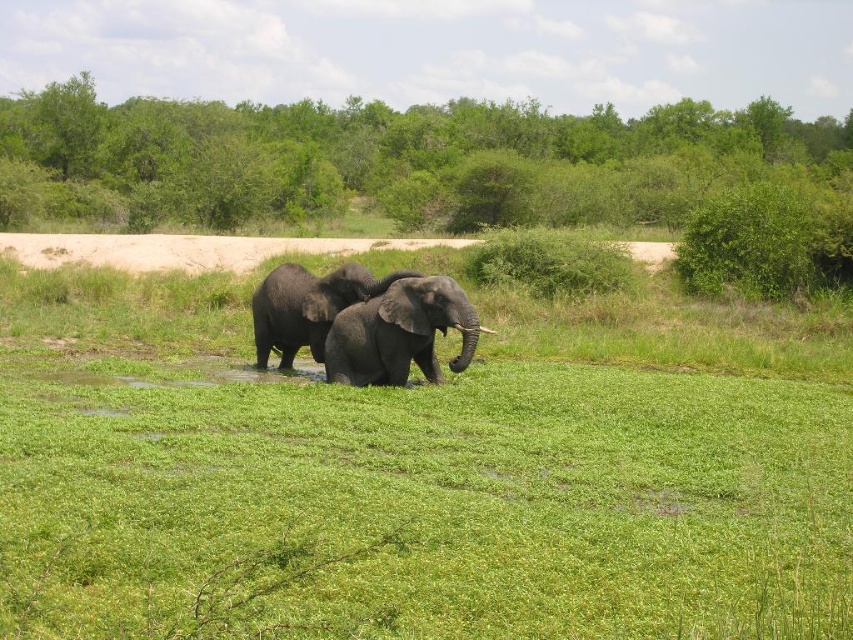
Is green grassy at center to the right of shiny gray elephant at center from the viewer's perspective?

Correct, you'll find green grassy at center to the right of shiny gray elephant at center.

Does green grassy at center have a lesser height compared to shiny gray elephant at center?

No, green grassy at center is not shorter than shiny gray elephant at center.

What do you see at coordinates (419, 468) in the screenshot? I see `green grassy at center` at bounding box center [419, 468].

The height and width of the screenshot is (640, 853). Find the location of `green grassy at center`. green grassy at center is located at coordinates (419, 468).

Looking at this image, between green grassy at center and shiny black elephant at center, which one has more height?

green grassy at center is taller.

Can you confirm if green grassy at center is wider than shiny black elephant at center?

Correct, the width of green grassy at center exceeds that of shiny black elephant at center.

What are the coordinates of `green grassy at center` in the screenshot? It's located at (419, 468).

Is shiny black elephant at center to the right of shiny gray elephant at center from the viewer's perspective?

Indeed, shiny black elephant at center is positioned on the right side of shiny gray elephant at center.

In the scene shown: Does shiny black elephant at center have a lesser width compared to shiny gray elephant at center?

Yes.

Which is in front, point (416, 324) or point (276, 276)?

Point (416, 324)

Locate an element on the screen. The image size is (853, 640). shiny black elephant at center is located at coordinates (399, 333).